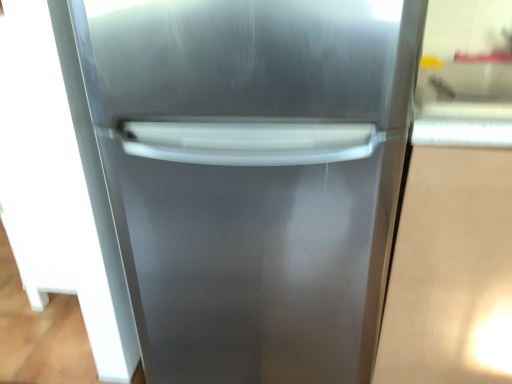
Question: Looking at their shapes, would you say stainless steel refrigerator at center is wider or thinner than polished silver refrigerator door at left?

Choices:
 (A) wide
 (B) thin

Answer: (A)

Question: Which is correct: stainless steel refrigerator at center is inside polished silver refrigerator door at left, or outside of it?

Choices:
 (A) inside
 (B) outside

Answer: (B)

Question: From the image's perspective, relative to polished silver refrigerator door at left, is stainless steel refrigerator at center above or below?

Choices:
 (A) above
 (B) below

Answer: (B)

Question: From a real-world perspective, is polished silver refrigerator door at left positioned above or below stainless steel refrigerator at center?

Choices:
 (A) above
 (B) below

Answer: (B)

Question: In the image, is polished silver refrigerator door at left on the left side or the right side of stainless steel refrigerator at center?

Choices:
 (A) right
 (B) left

Answer: (B)

Question: Is polished silver refrigerator door at left taller or shorter than stainless steel refrigerator at center?

Choices:
 (A) short
 (B) tall

Answer: (A)

Question: From the image's perspective, relative to stainless steel refrigerator at center, is polished silver refrigerator door at left above or below?

Choices:
 (A) above
 (B) below

Answer: (A)